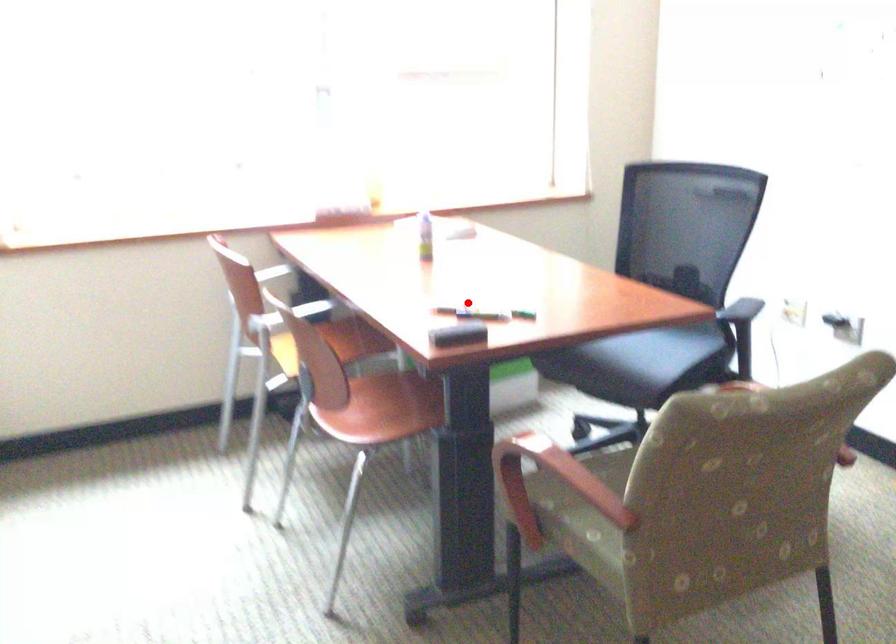
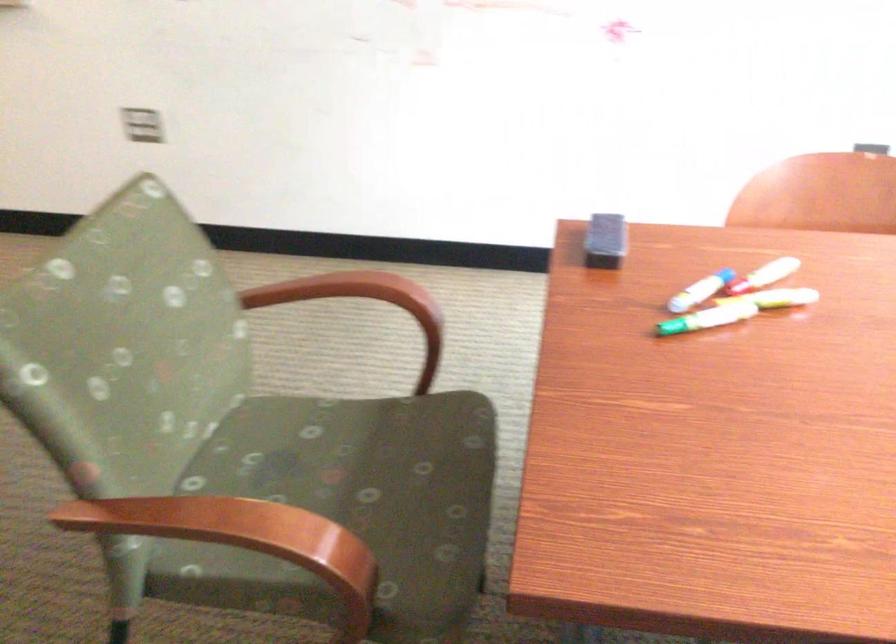
Question: I am providing you with two images of the same scene from different viewpoints. Given a red point in image1, look at the same physical point in image2. Is it:

Choices:
 (A) Closer to the viewpoint
 (B) Farther from the viewpoint

Answer: (A)